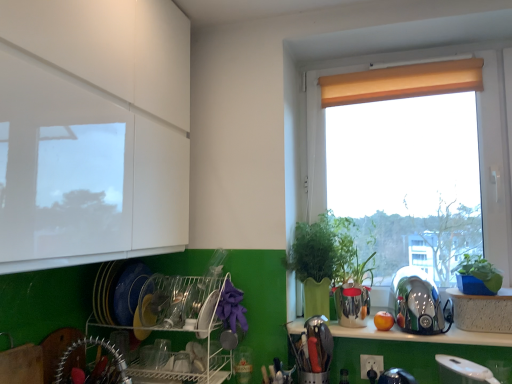
Question: Is beige fabric curtain at upper right situated inside brushed metal utensil rack at lower left, positioned as the first appliance in left-to-right order, or outside?

Choices:
 (A) outside
 (B) inside

Answer: (A)

Question: Considering the positions of beige fabric curtain at upper right and brushed metal utensil rack at lower left, positioned as the first appliance in left-to-right order, in the image, is beige fabric curtain at upper right wider or thinner than brushed metal utensil rack at lower left, positioned as the first appliance in left-to-right order,?

Choices:
 (A) thin
 (B) wide

Answer: (A)

Question: Estimate the real-world distances between objects in this image. Which object is closer to the metallic silver utensil holder at lower center, acting as the third appliance starting from the right?

Choices:
 (A) white plastic dish rack at lower left
 (B) beige fabric curtain at upper right
 (C) green matte plant at right
 (D) white glossy kettle at lower right, the 4th appliance when ordered from left to right
 (E) brushed metal utensil rack at lower left, positioned as the first appliance in left-to-right order

Answer: (C)

Question: Which of these objects is positioned farthest from the beige fabric curtain at upper right?

Choices:
 (A) white plastic dish rack at lower left
 (B) white glossy kettle at lower right, placed as the first appliance when sorted from right to left
 (C) brushed metal utensil rack at lower left, positioned as the first appliance in left-to-right order
 (D) green matte plant at right
 (E) green plastic pot at right

Answer: (C)